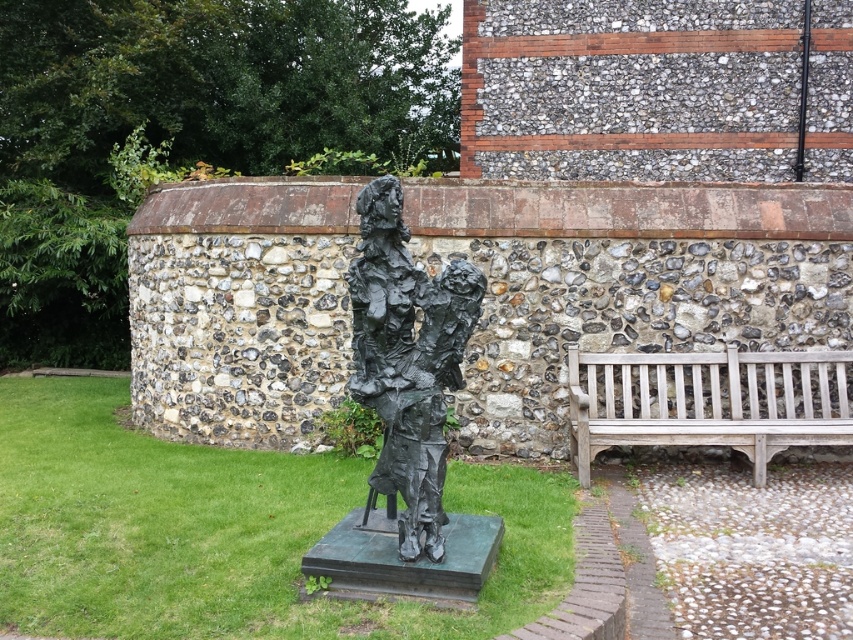
You are an artist planning to photograph the bronze statue at center and the wooden bench at right. You want to ensure that both subjects are clearly visible in the frame. Considering their sizes, which object should you place closer to the camera to maintain clarity?

The bronze statue at center is thinner than the wooden bench at right, so placing the wooden bench at right closer to the camera will ensure its details are clearer in the photograph.

You are standing at the center of the image. Which direction should you move to get closer to the bronze statue at center?

Since the bronze statue at center is already at the center of the image, you don not need to move in any direction to get closer to it. You are already at the optimal position.